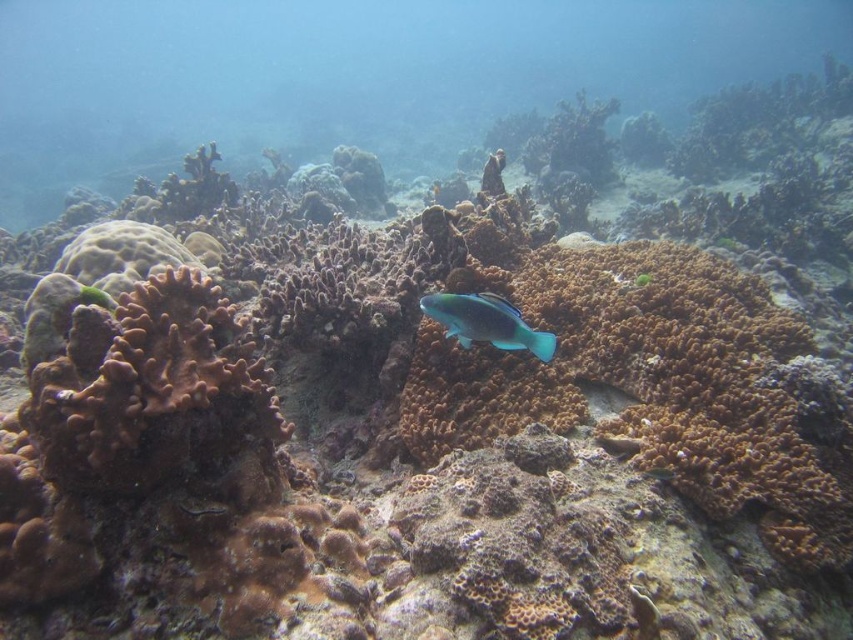
Question: Is brown rough coral at left positioned at the back of teal glossy fish at center?

Choices:
 (A) yes
 (B) no

Answer: (B)

Question: Does brown rough coral at left lie in front of teal glossy fish at center?

Choices:
 (A) no
 (B) yes

Answer: (B)

Question: Is brown rough coral at left to the right of teal glossy fish at center from the viewer's perspective?

Choices:
 (A) yes
 (B) no

Answer: (B)

Question: Which of the following is the farthest from the observer?

Choices:
 (A) brown rough coral at left
 (B) teal glossy fish at center

Answer: (B)

Question: Which point is closer to the camera taking this photo?

Choices:
 (A) (45, 436)
 (B) (479, 304)

Answer: (A)